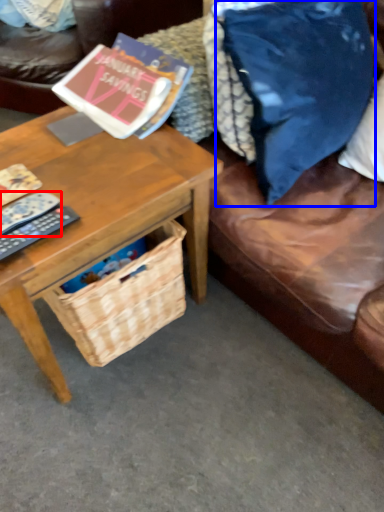
Question: Which of the following is the farthest to the observer, remote control (highlighted by a red box) or throw pillow (highlighted by a blue box)?

Choices:
 (A) remote control
 (B) throw pillow

Answer: (A)